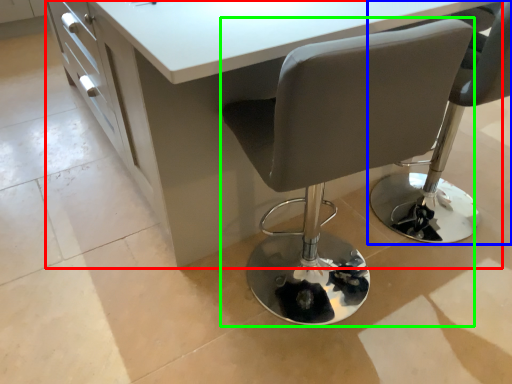
Question: Which is farther away from table (highlighted by a red box)? chair (highlighted by a blue box) or chair (highlighted by a green box)?

Choices:
 (A) chair
 (B) chair

Answer: (A)